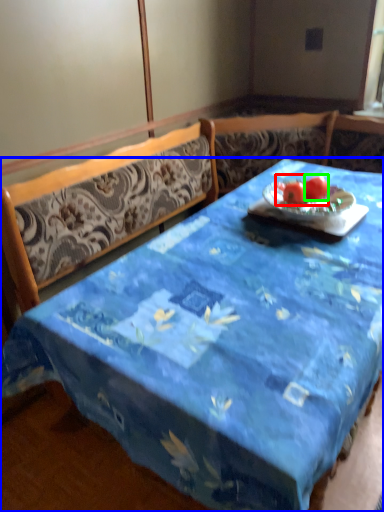
Question: Based on their relative distances, which object is farther from fruit (highlighted by a red box)? Choose from desk (highlighted by a blue box) and tomato (highlighted by a green box).

Choices:
 (A) desk
 (B) tomato

Answer: (A)